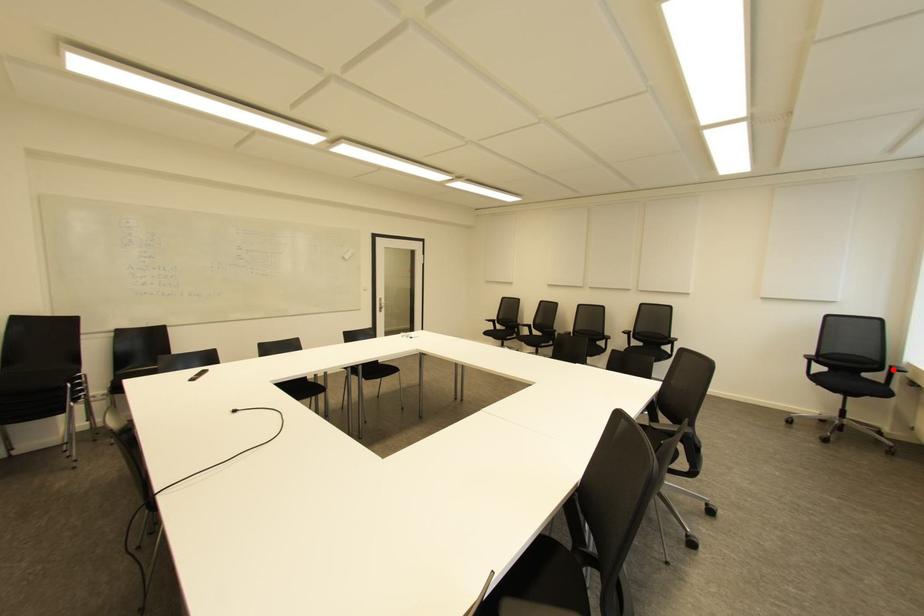
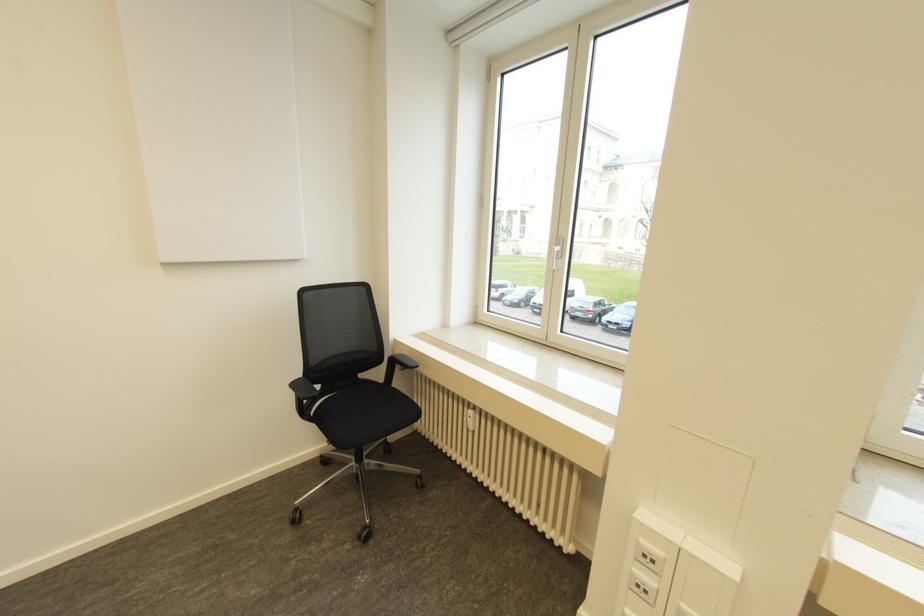
Locate, in the second image, the point that corresponds to the highlighted location in the first image.

(394, 360)